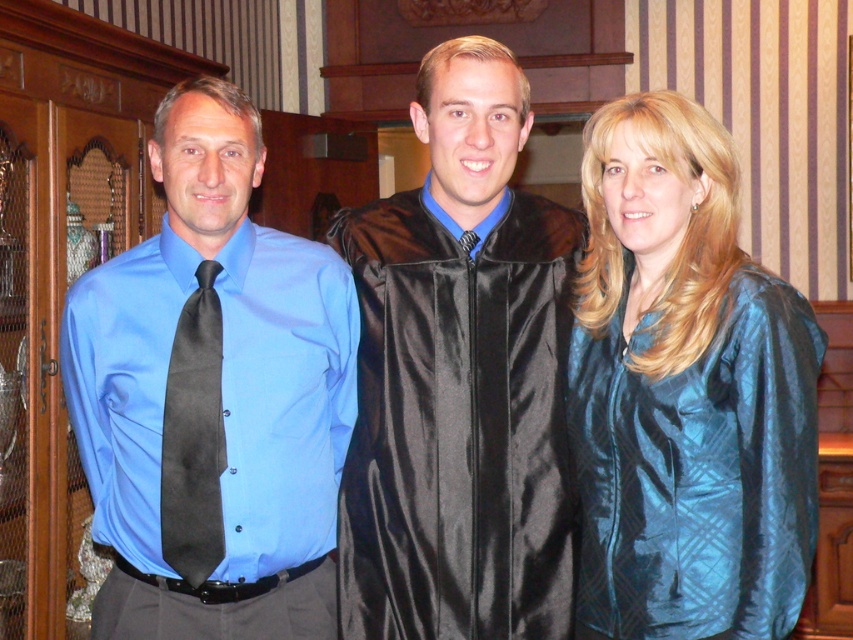
You are a photographer adjusting the lighting for the portrait. The teal silk blouse at center and the black satin tie at left are in your frame. Which item is closer to the camera?

The teal silk blouse at center is positioned over the black satin tie at left, meaning it is closer to the camera.

You are standing in front of the graduation portrait. There are two points marked in the image. The first point is at coordinates point (471, 392) and the second point is at point (200, 380). Which point is closer to you?

Point (200, 380) is closer to you because it is in front of point (471, 392).

You are standing in front of the family portrait and want to touch the teal silk blouse at center and the black satin tie at left. Which one can you reach first without moving your hand?

The teal silk blouse at center can be reached first because it is closer to the viewer than the black satin tie at left.